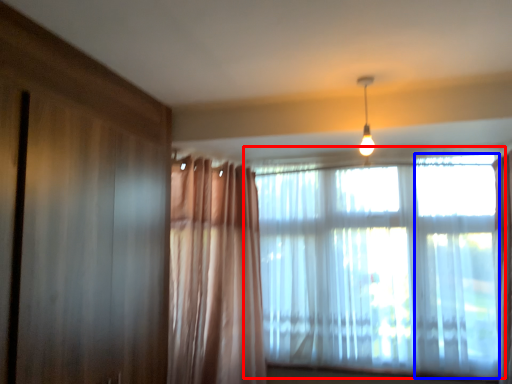
Question: Which object appears closest to the camera in this image, window (highlighted by a red box) or window (highlighted by a blue box)?

Choices:
 (A) window
 (B) window

Answer: (B)